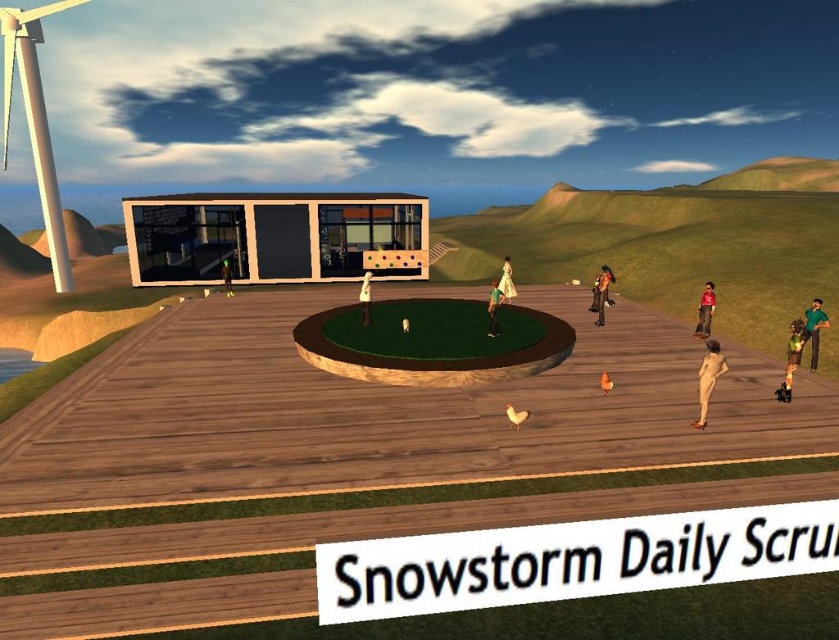
You are standing at the edge of the wooden platform in the image. There is a point marked at coordinates point (821,314). Can you walk from your current position to that point without needing to move more than 30 feet?

The distance between point (821,314) and the viewer is 31.57 feet, which is more than 30 feet. Therefore, you would need to move more than 30 feet to reach that point.